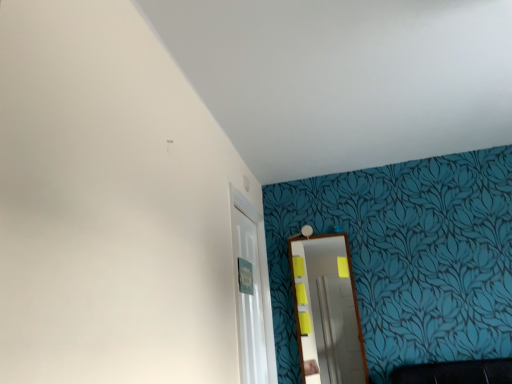
Question: Looking at the image, does wooden mirror at center seem bigger or smaller compared to white glossy door at center?

Choices:
 (A) small
 (B) big

Answer: (A)

Question: Is wooden mirror at center wider or thinner than white glossy door at center?

Choices:
 (A) wide
 (B) thin

Answer: (B)

Question: Is point [x=331, y=336] positioned closer to the camera than point [x=230, y=215]?

Choices:
 (A) closer
 (B) farther

Answer: (B)

Question: In terms of height, does white glossy door at center look taller or shorter compared to wooden mirror at center?

Choices:
 (A) short
 (B) tall

Answer: (B)

Question: Is white glossy door at center situated inside wooden mirror at center or outside?

Choices:
 (A) inside
 (B) outside

Answer: (B)

Question: Does point (262, 319) appear closer or farther from the camera than point (339, 291)?

Choices:
 (A) closer
 (B) farther

Answer: (B)

Question: From a real-world perspective, relative to wooden mirror at center, is white glossy door at center vertically above or below?

Choices:
 (A) above
 (B) below

Answer: (A)